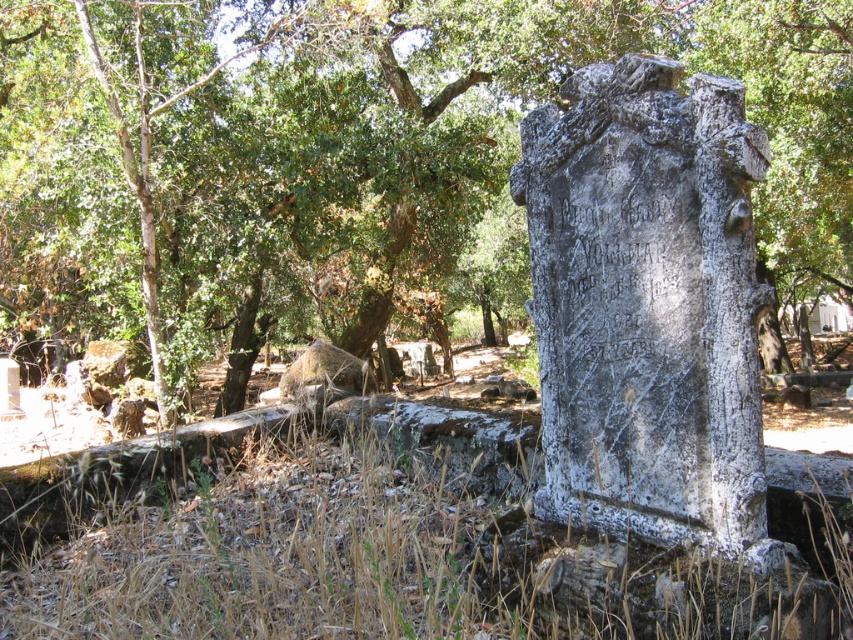
Can you confirm if green leafy tree at center is wider than dry grass at lower center?

Yes.

Does green leafy tree at center appear under dry grass at lower center?

Incorrect, green leafy tree at center is not positioned below dry grass at lower center.

What do you see at coordinates (349, 156) in the screenshot? I see `green leafy tree at center` at bounding box center [349, 156].

The width and height of the screenshot is (853, 640). Find the location of `green leafy tree at center`. green leafy tree at center is located at coordinates (349, 156).

Is point (442, 289) positioned in front of point (735, 518)?

No, (442, 289) is further to viewer.

Who is higher up, green leafy tree at center or white stone pillar at center?

green leafy tree at center is above.

What do you see at coordinates (349, 156) in the screenshot? I see `green leafy tree at center` at bounding box center [349, 156].

This screenshot has width=853, height=640. What are the coordinates of `green leafy tree at center` in the screenshot? It's located at (349, 156).

Does white stone pillar at center appear on the left side of dry grass at lower center?

In fact, white stone pillar at center is to the right of dry grass at lower center.

The image size is (853, 640). In order to click on white stone pillar at center in this screenshot , I will do `click(646, 304)`.

The image size is (853, 640). Find the location of `white stone pillar at center`. white stone pillar at center is located at coordinates (646, 304).